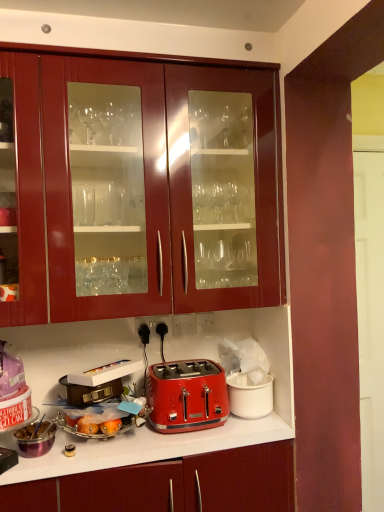
In order to click on free space in front of red metallic toaster at center in this screenshot , I will do `click(175, 444)`.